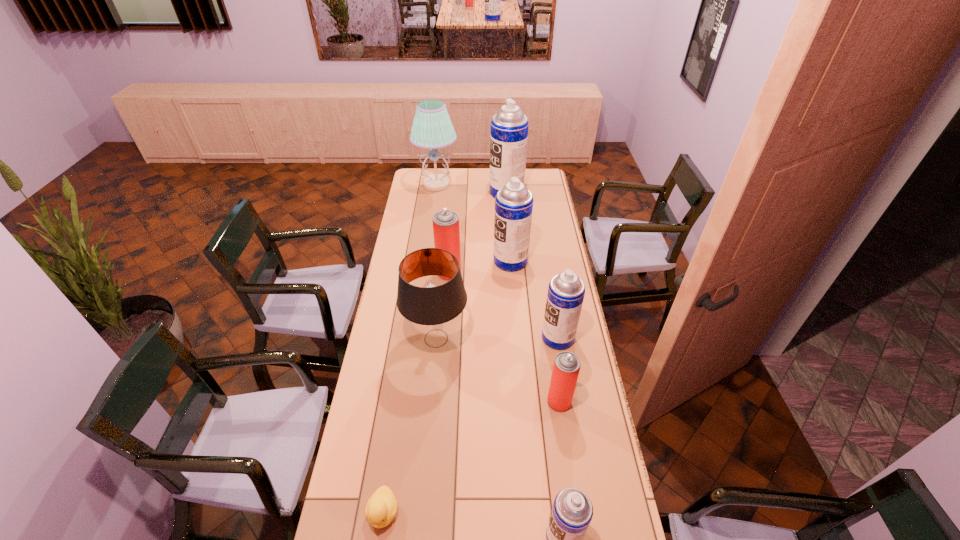
In order to click on duck at the left edge in this screenshot , I will do `click(381, 508)`.

Where is `object that is at the far left corner`? This screenshot has width=960, height=540. object that is at the far left corner is located at coordinates (432, 128).

Find the location of a particular element. The image size is (960, 540). object located in the far right corner section of the desktop is located at coordinates (509, 127).

Find the location of a particular element. This screenshot has height=540, width=960. vacant region at the far edge of the desktop is located at coordinates (460, 180).

This screenshot has width=960, height=540. I want to click on free space at the left edge, so click(x=419, y=197).

Locate an element on the screen. The height and width of the screenshot is (540, 960). free space at the far right corner is located at coordinates (542, 170).

The width and height of the screenshot is (960, 540). I want to click on free space between the shortest object and the left red aerosol can, so click(x=416, y=393).

Image resolution: width=960 pixels, height=540 pixels. What are the coordinates of `empty space that is in between the left red aerosol can and the second biggest blue aerosol can` in the screenshot? It's located at (480, 267).

Locate an element on the screen. The image size is (960, 540). vacant region between the teal lamp and the tallest aerosol can is located at coordinates (471, 188).

This screenshot has height=540, width=960. What are the coordinates of `free space between the leftmost aerosol can and the duck` in the screenshot? It's located at (416, 393).